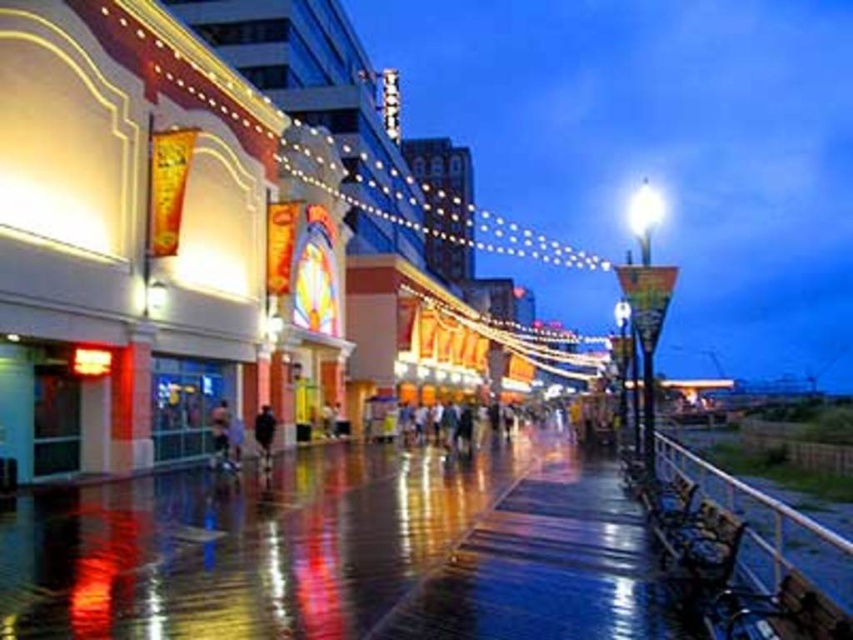
Question: Is glossy concrete pavement at center above black matte jacket at center?

Choices:
 (A) yes
 (B) no

Answer: (B)

Question: Considering the relative positions of glossy concrete pavement at center and black matte jacket at center in the image provided, where is glossy concrete pavement at center located with respect to black matte jacket at center?

Choices:
 (A) right
 (B) left

Answer: (A)

Question: Which point is farther to the camera?

Choices:
 (A) (61, 564)
 (B) (267, 465)

Answer: (B)

Question: Can you confirm if glossy concrete pavement at center is wider than black matte jacket at center?

Choices:
 (A) no
 (B) yes

Answer: (B)